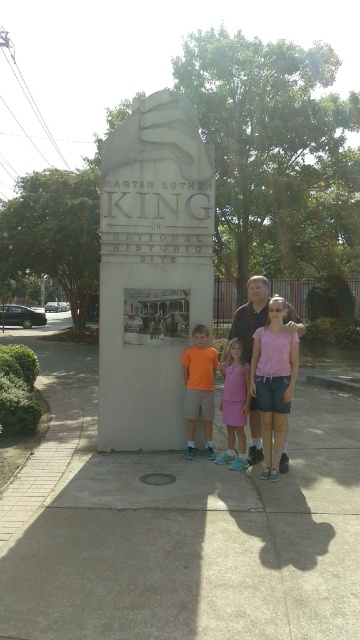
Question: Does concrete at center appear over pink fabric shirt at center?

Choices:
 (A) yes
 (B) no

Answer: (B)

Question: Observing the image, what is the correct spatial positioning of concrete at center in reference to pink fabric dress at center?

Choices:
 (A) below
 (B) above

Answer: (A)

Question: Can you confirm if pink fabric shirt at center is positioned above orange cotton shirt at lower center?

Choices:
 (A) no
 (B) yes

Answer: (B)

Question: Which point is closer to the camera taking this photo?

Choices:
 (A) (300, 404)
 (B) (231, 416)
 (C) (293, 355)
 (D) (191, 380)

Answer: (C)

Question: Considering the real-world distances, which object is farthest from the orange cotton shirt at lower center?

Choices:
 (A) pink fabric shirt at center
 (B) concrete at center

Answer: (B)

Question: Among these points, which one is nearest to the camera?

Choices:
 (A) (291, 362)
 (B) (321, 595)

Answer: (B)